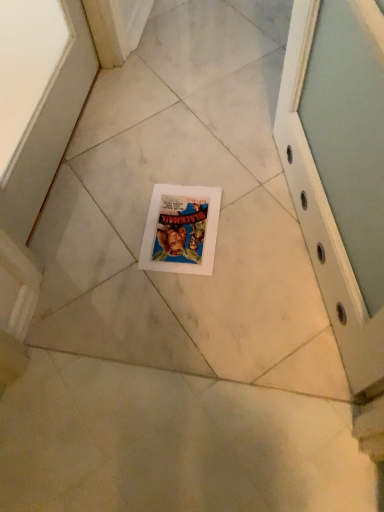
Image resolution: width=384 pixels, height=512 pixels. What are the coordinates of `vacant point to the right of white paper comic book at center` in the screenshot? It's located at (256, 218).